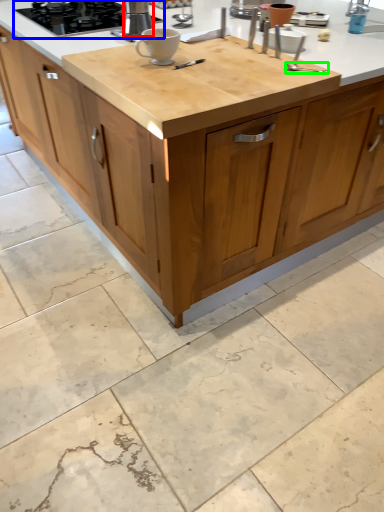
Question: Estimate the real-world distances between objects in this image. Which object is closer to kitchen appliance (highlighted by a red box), gas stove (highlighted by a blue box) or utensil (highlighted by a green box)?

Choices:
 (A) gas stove
 (B) utensil

Answer: (A)